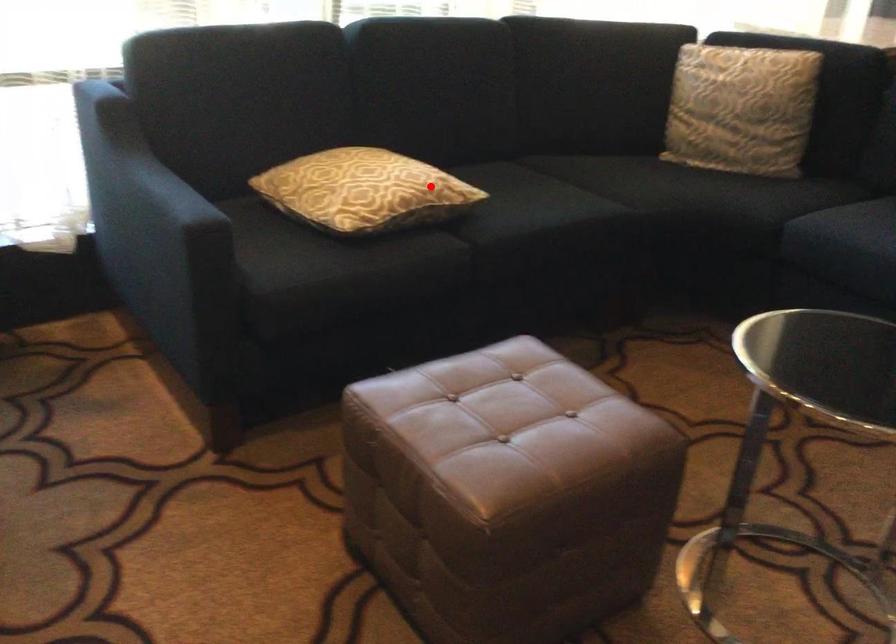
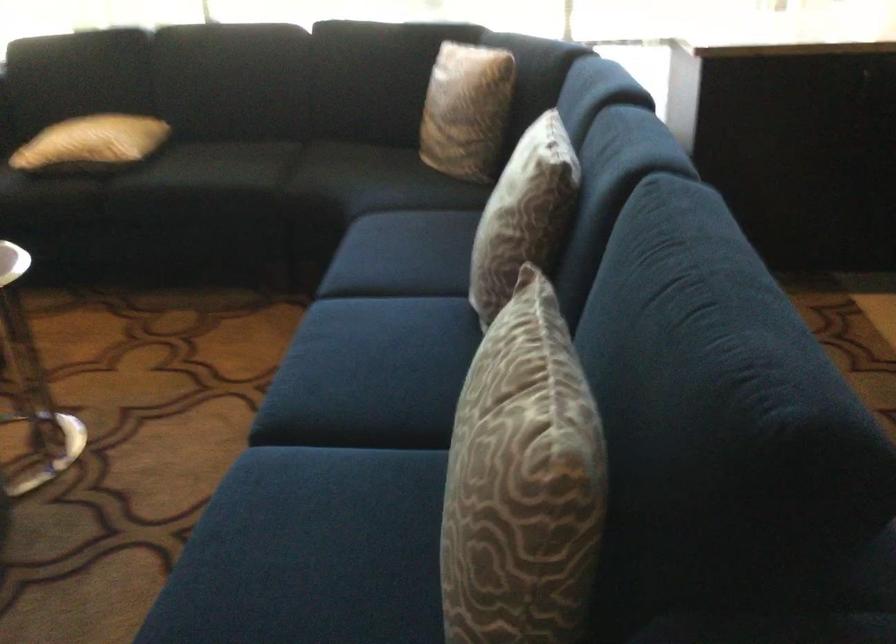
Question: I am providing you with two images of the same scene from different viewpoints. In image1, a red point is highlighted. Considering the same 3D point in image2, which of the following is correct?

Choices:
 (A) It is closer
 (B) It is farther

Answer: (B)